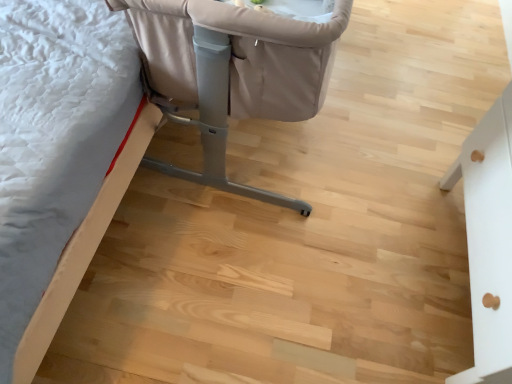
Find the location of a particular element. This screenshot has height=384, width=512. free area in between beige fabric crib at upper center, arranged as the second furniture when viewed from the left, and white matte drawer at right, which appears as the third furniture when viewed from the left is located at coordinates (355, 196).